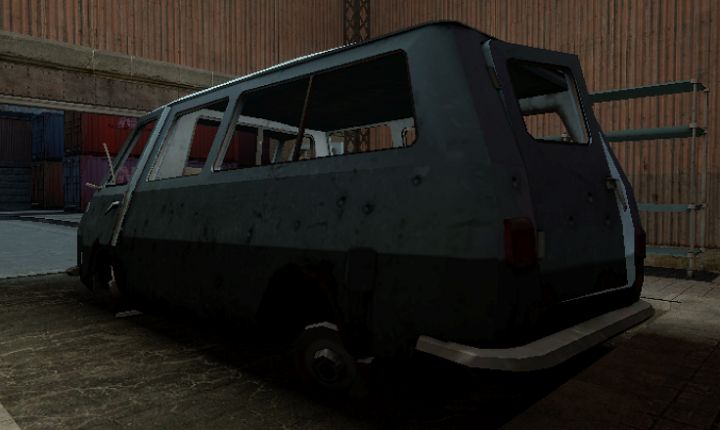
Where is `walls`? walls is located at coordinates (207, 15), (574, 31).